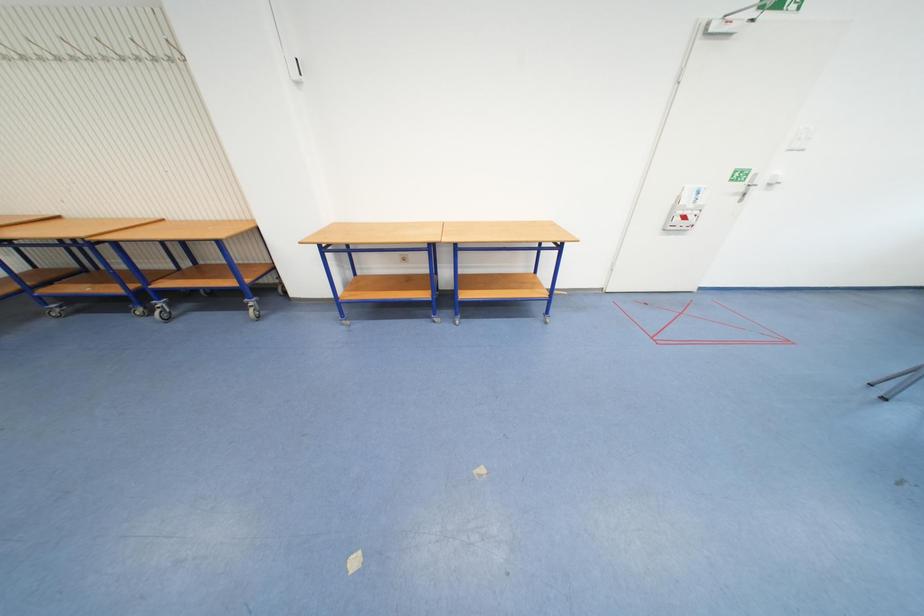
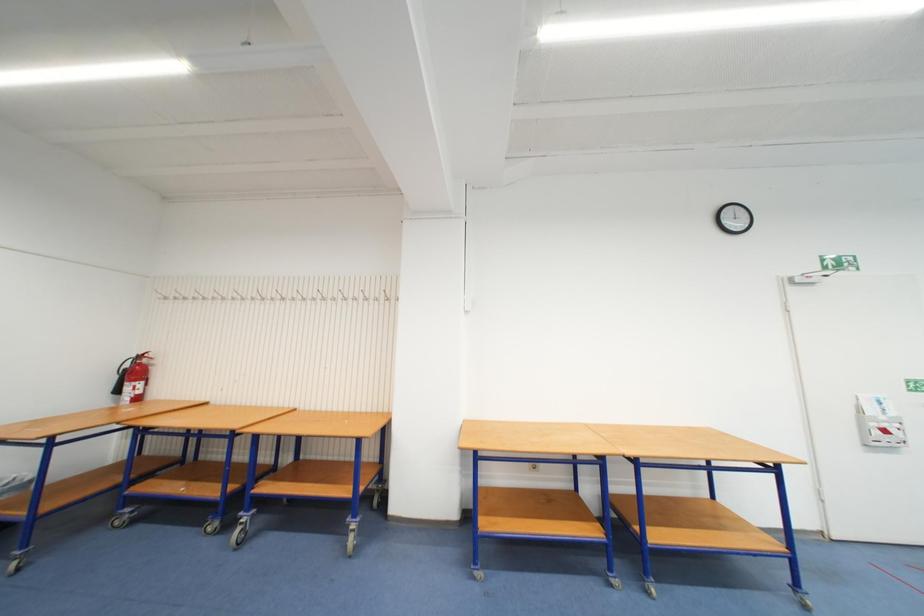
Question: The first image is from the beginning of the video and the second image is from the end. How did the camera likely rotate when shooting the video?

Choices:
 (A) Left
 (B) Right
 (C) Up
 (D) Down

Answer: (C)